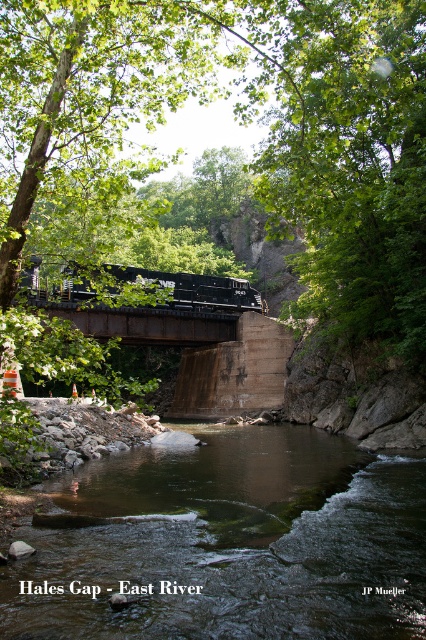
Question: Is green leafy tree at upper center below clear water at center?

Choices:
 (A) no
 (B) yes

Answer: (A)

Question: Is green leafy tree at upper center bigger than black metal train at center?

Choices:
 (A) yes
 (B) no

Answer: (A)

Question: Estimate the real-world distances between objects in this image. Which object is farther from the black metal train at center?

Choices:
 (A) clear water at center
 (B) green leafy tree at upper center

Answer: (B)

Question: Which object is closer to the camera taking this photo?

Choices:
 (A) green leafy tree at upper center
 (B) clear water at center
 (C) black metal train at center

Answer: (B)

Question: Which of these objects is positioned farthest from the clear water at center?

Choices:
 (A) black metal train at center
 (B) green leafy tree at upper center

Answer: (B)

Question: Can you confirm if green leafy tree at upper center is positioned to the right of clear water at center?

Choices:
 (A) no
 (B) yes

Answer: (B)